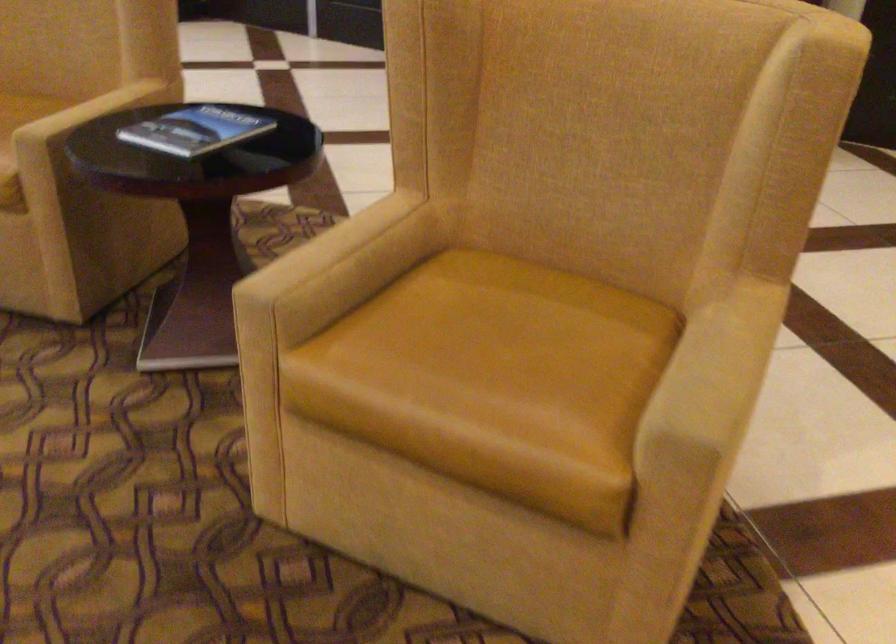
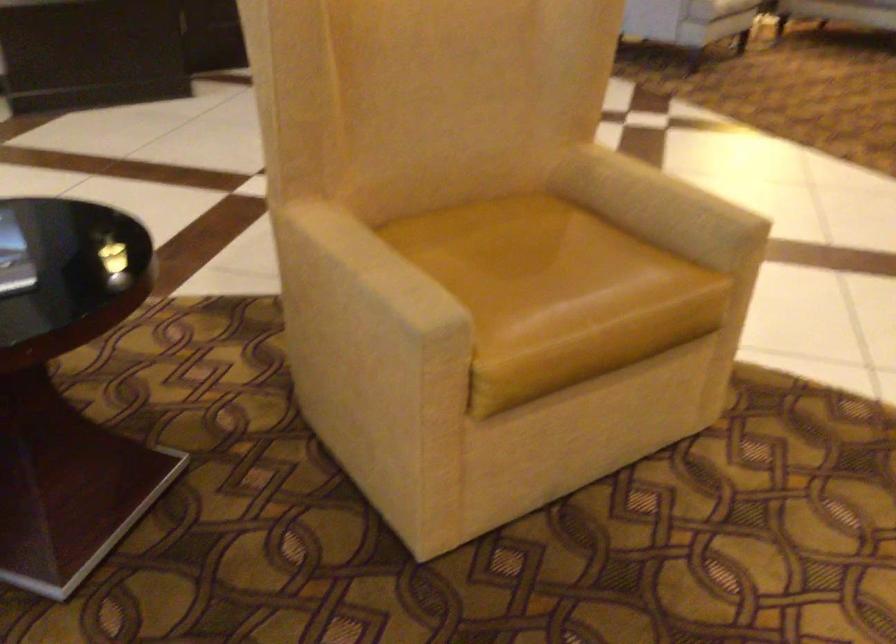
Locate, in the second image, the point that corresponds to point 337,249 in the first image.

(375, 266)